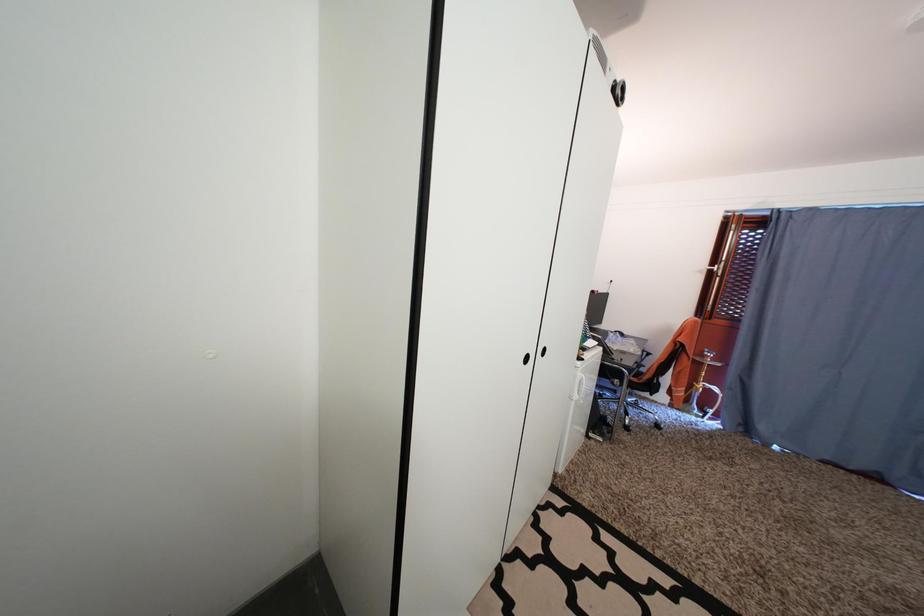
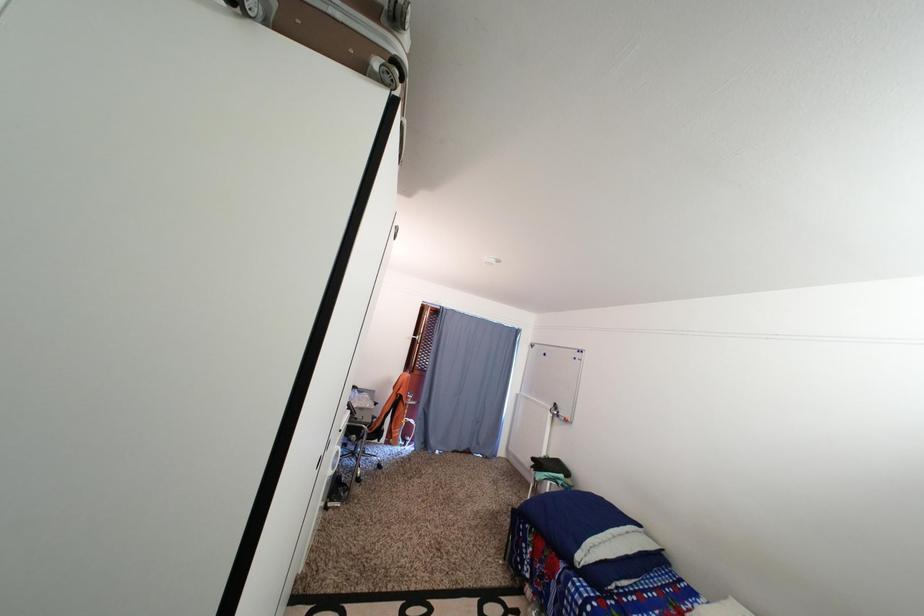
Question: The images are taken continuously from a first-person perspective. In which direction is your viewpoint rotating?

Choices:
 (A) Left
 (B) Right
 (C) Up
 (D) Down

Answer: (B)